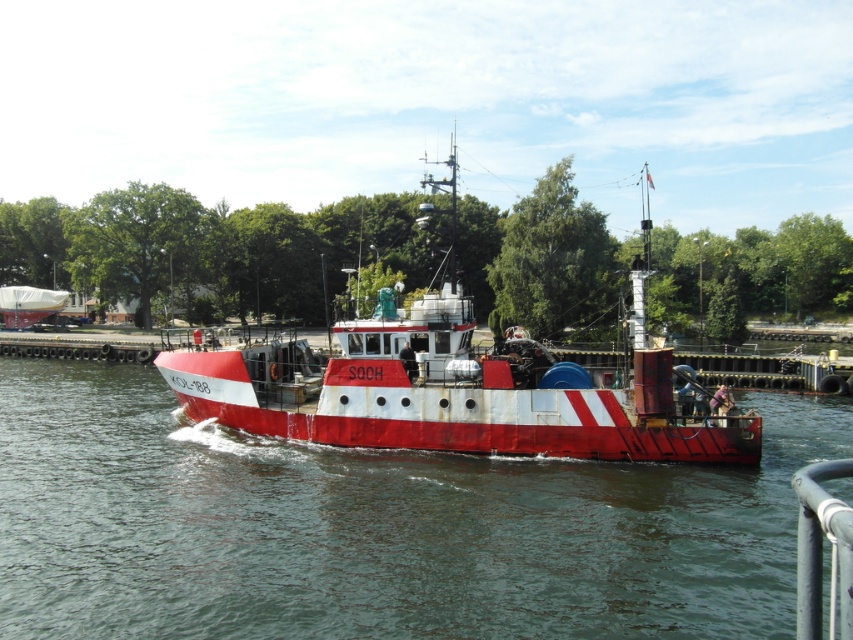
Is smooth water at center closer to the viewer compared to rusty metal boat at center?

That is True.

Does point (15, 636) lie behind point (563, 385)?

That is False.

Measure the distance between point (189, 616) and camera.

Point (189, 616) is 37.47 feet from camera.

The height and width of the screenshot is (640, 853). I want to click on smooth water at center, so click(x=374, y=528).

Can you confirm if rusty metal boat at center is wider than white tarpaulin boat at left?

Yes, rusty metal boat at center is wider than white tarpaulin boat at left.

Does point (680, 422) come farther from viewer compared to point (12, 296)?

No, (680, 422) is in front of (12, 296).

What do you see at coordinates (454, 388) in the screenshot? This screenshot has height=640, width=853. I see `rusty metal boat at center` at bounding box center [454, 388].

Identify the location of rusty metal boat at center. This screenshot has width=853, height=640. point(454,388).

Is smooth water at center positioned in front of white tarpaulin boat at left?

That is True.

Which is above, smooth water at center or white tarpaulin boat at left?

white tarpaulin boat at left

Where is `smooth water at center`? The height and width of the screenshot is (640, 853). smooth water at center is located at coordinates (374, 528).

Where is `smooth water at center`? Image resolution: width=853 pixels, height=640 pixels. smooth water at center is located at coordinates (374, 528).